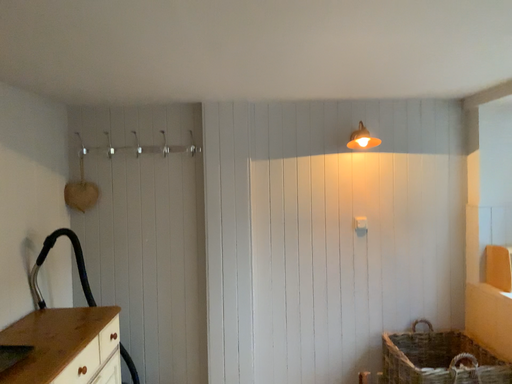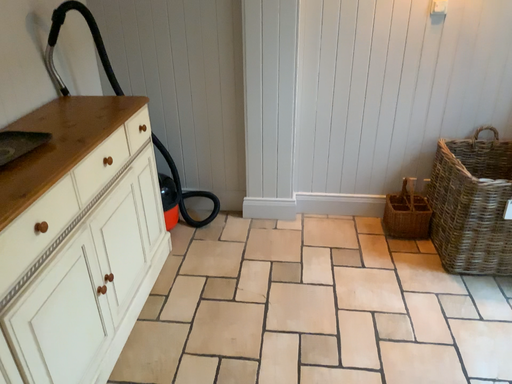
Question: Which way did the camera rotate in the video?

Choices:
 (A) rotated downward
 (B) rotated upward

Answer: (A)